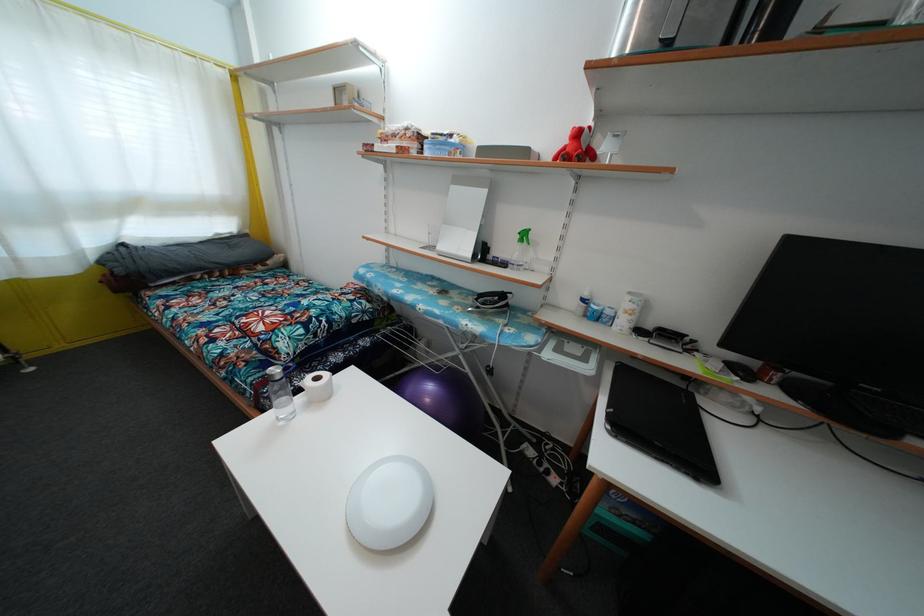
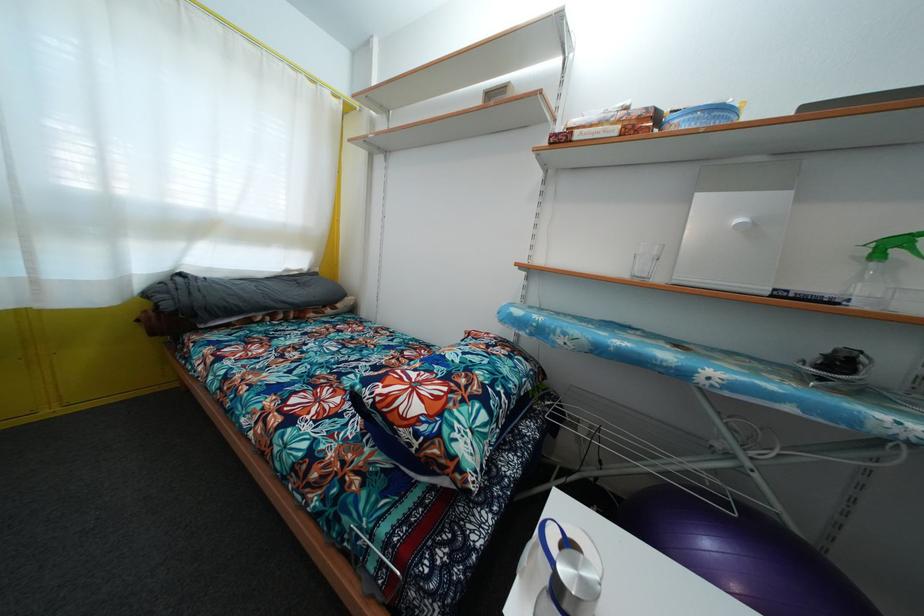
Question: The first image is from the beginning of the video and the second image is from the end. How did the camera likely rotate when shooting the video?

Choices:
 (A) Left
 (B) Right
 (C) Up
 (D) Down

Answer: (C)